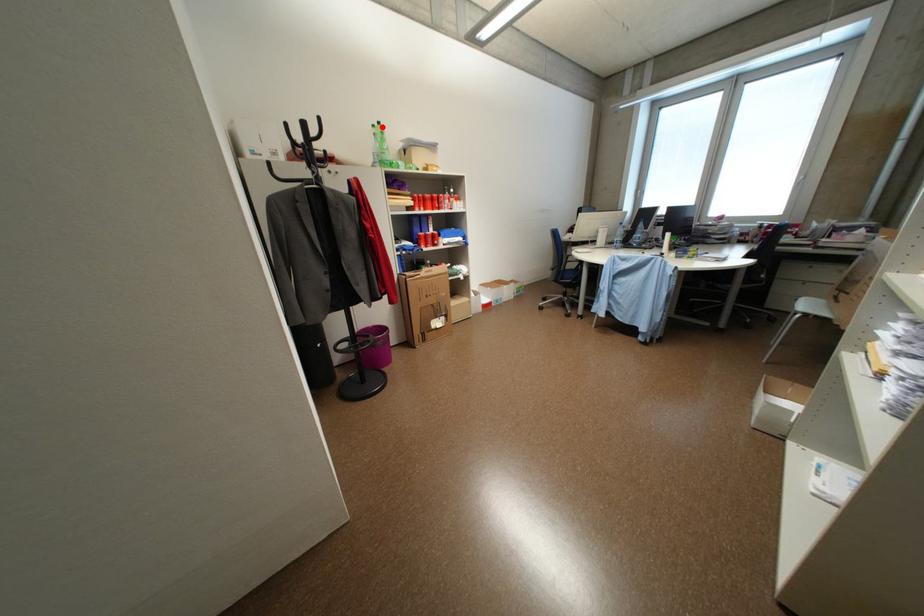
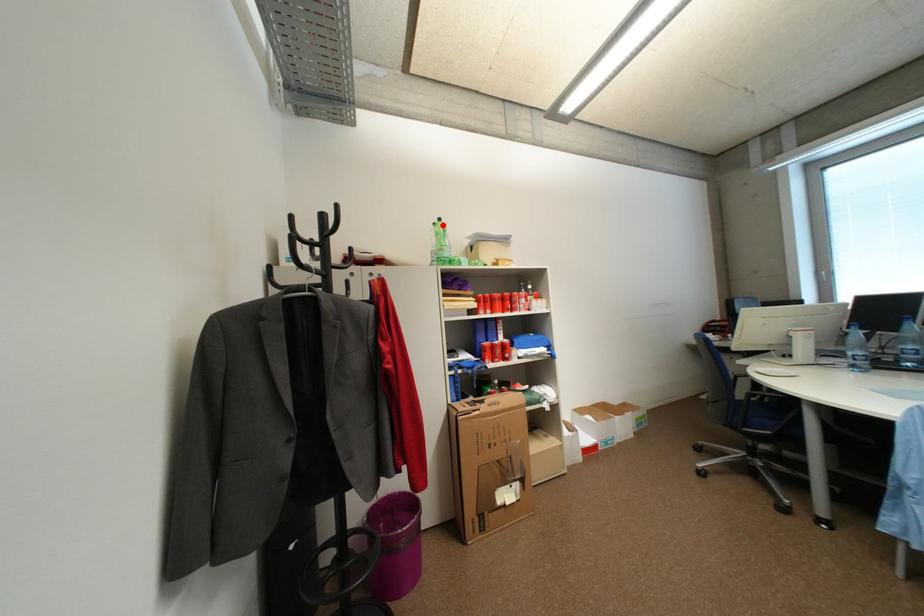
I am providing you with two images of the same scene from different viewpoints. A red point is marked on the first image and another point is marked on the second image. Are the points marked in image1 and image2 representing the same 3D position?

Yes